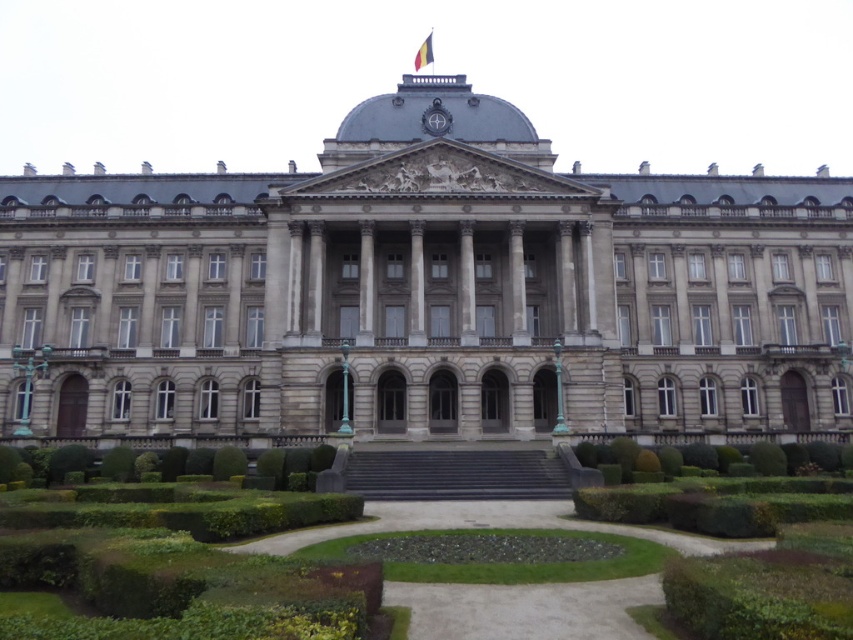
Between gray stone palace at center and green leafy bush at center, which one has more height?

Standing taller between the two is gray stone palace at center.

At what (x,y) coordinates should I click in order to perform the action: click on gray stone palace at center. Please return your answer as a coordinate pair (x, y). The width and height of the screenshot is (853, 640). Looking at the image, I should click on (425, 292).

At what (x,y) coordinates should I click in order to perform the action: click on gray stone palace at center. Please return your answer as a coordinate pair (x, y). This screenshot has height=640, width=853. Looking at the image, I should click on (425, 292).